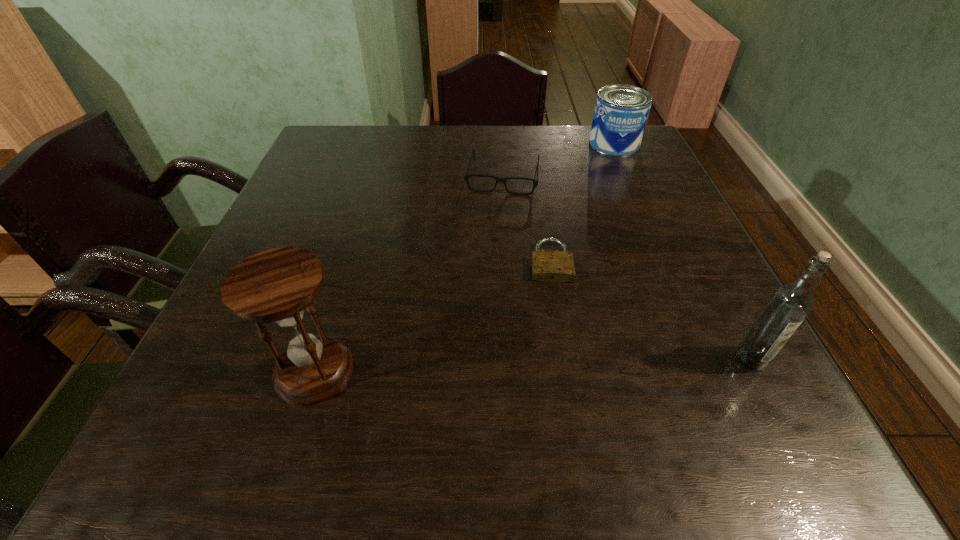
Where is `vacant space in between the second shortest object and the shortest object`? Image resolution: width=960 pixels, height=540 pixels. vacant space in between the second shortest object and the shortest object is located at coordinates (527, 219).

Locate an element on the screen. free area in between the vodka and the second farthest object is located at coordinates (627, 267).

Identify the location of free space that is in between the shortest object and the farthest object. (583, 202).

Locate an element on the screen. empty location between the fourth nearest object and the leftmost object is located at coordinates (409, 273).

Locate which object is the closest to the second farthest object. Please provide its 2D coordinates. Your answer should be formatted as a tuple, i.e. [(x, y)], where the tuple contains the x and y coordinates of a point satisfying the conditions above.

[(621, 111)]

This screenshot has width=960, height=540. I want to click on the third closest object relative to the third tallest object, so click(788, 306).

This screenshot has width=960, height=540. I want to click on vacant space that satisfies the following two spatial constraints: 1. on the back side of the hourglass; 2. on the right side of the third tallest object, so click(385, 144).